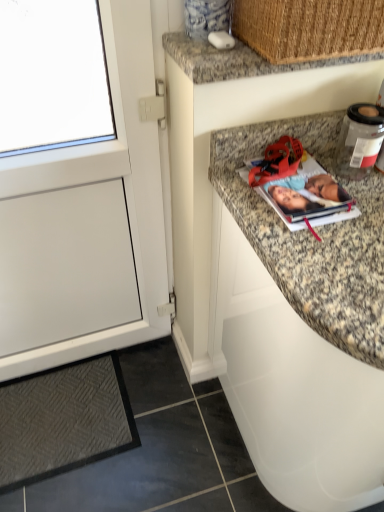
Where is `blank area beneath dark gray textured mat at lower left (from a real-world perspective)`? The height and width of the screenshot is (512, 384). blank area beneath dark gray textured mat at lower left (from a real-world perspective) is located at coordinates (86, 419).